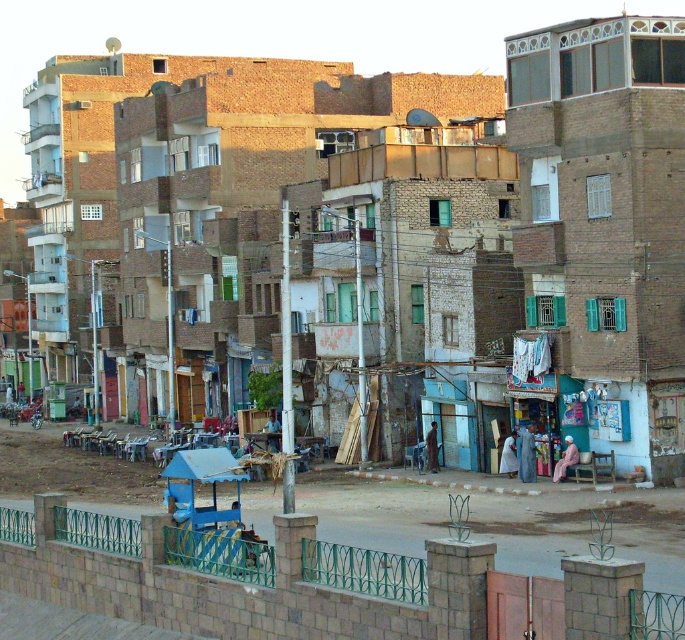
You are a traveler who wants to buy a souvenir. You see two fabrics available at the market stalls. The light blue fabric at center is displayed on a large stand, and the pink fabric at lower center is on a smaller table. Which fabric has a larger display area?

The light blue fabric at center has a larger display area since it is larger in size than the pink fabric at lower center.

You are a tailor in the city and need to decide which fabric to use for a new dress. You see the blue fabric dress at lower center and the dark blue fabric at center. Which fabric has a larger width?

The blue fabric dress at lower center has a larger width than the dark blue fabric at center.